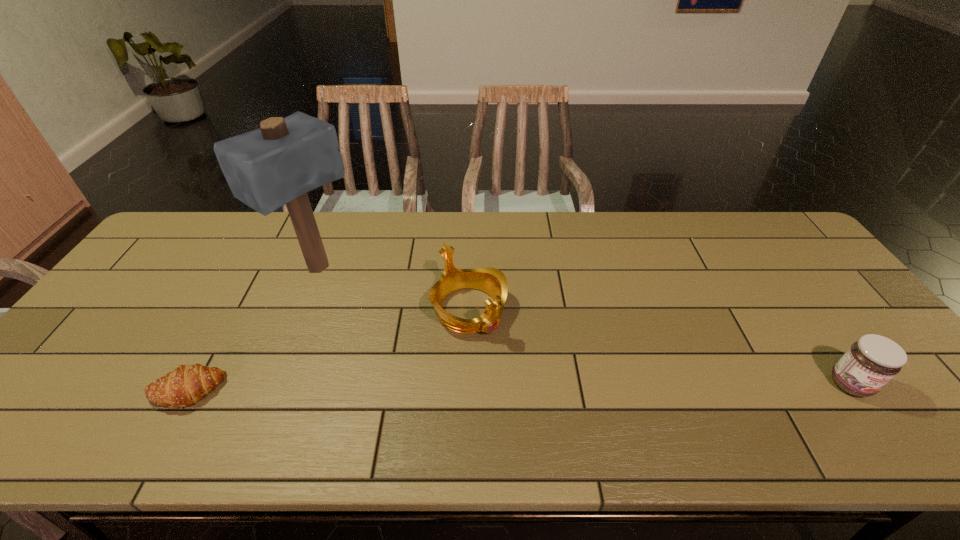
The height and width of the screenshot is (540, 960). What are the coordinates of `vacant space on the desktop that is between the shortest object and the rightmost object and is positioned on the striking surface of the mallet` in the screenshot? It's located at (492, 388).

Locate an element on the screen. The image size is (960, 540). vacant space on the desktop that is between the shortest object and the rightmost object and is positioned at the front emblem of the second object from right to left is located at coordinates (535, 387).